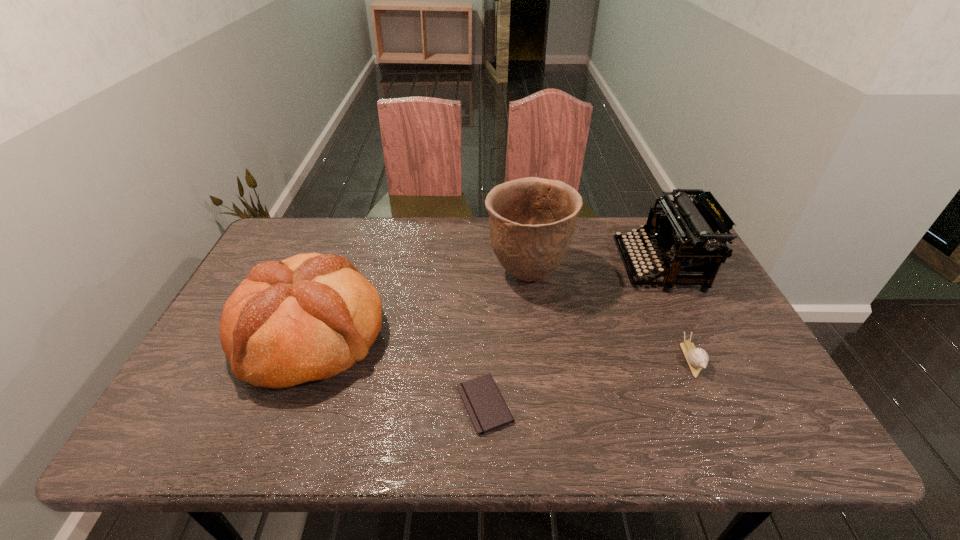
Where is `blank space at the near edge`? Image resolution: width=960 pixels, height=540 pixels. blank space at the near edge is located at coordinates (708, 422).

Locate an element on the screen. Image resolution: width=960 pixels, height=540 pixels. blank space at the right edge of the desktop is located at coordinates (773, 411).

This screenshot has width=960, height=540. Find the location of `free space at the far left corner`. free space at the far left corner is located at coordinates (301, 239).

I want to click on empty location between the escargot and the shortest object, so click(x=588, y=381).

The height and width of the screenshot is (540, 960). I want to click on vacant point located between the escargot and the tallest object, so click(x=610, y=317).

Locate an element on the screen. unoccupied area between the leftmost object and the shortest object is located at coordinates (397, 369).

Locate an element on the screen. vacant area that lies between the bread and the shortest object is located at coordinates (397, 369).

Locate an element on the screen. The width and height of the screenshot is (960, 540). free space between the checkbook and the pottery is located at coordinates (506, 340).

Locate an element on the screen. free space between the leftmost object and the typewriter is located at coordinates click(485, 301).

Image resolution: width=960 pixels, height=540 pixels. What are the coordinates of `free space that is in between the checkbook and the bread` in the screenshot? It's located at [397, 369].